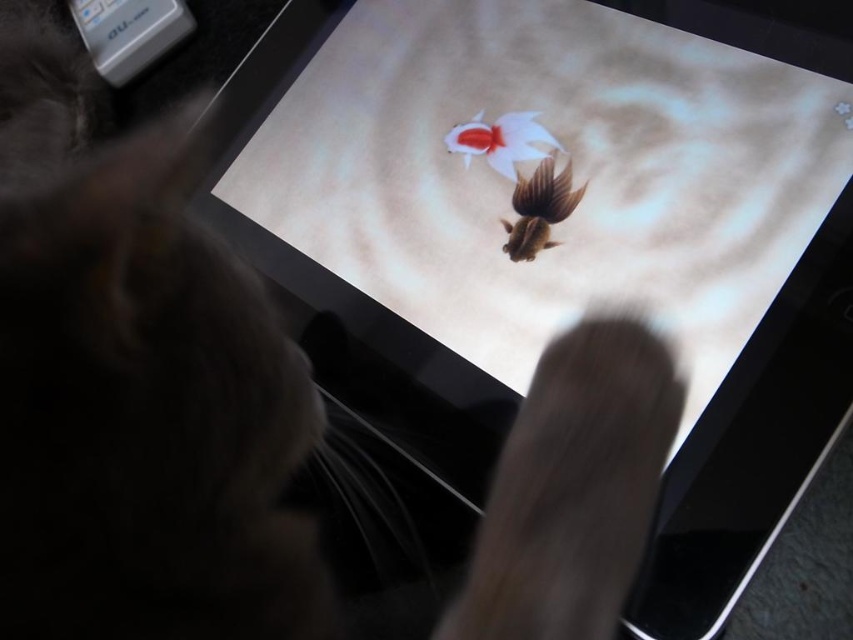
Question: Does shiny brown fish at center lie behind white glossy goldfish at center?

Choices:
 (A) yes
 (B) no

Answer: (B)

Question: Which point is closer to the camera taking this photo?

Choices:
 (A) (448, 144)
 (B) (547, 164)

Answer: (B)

Question: Which point is farther to the camera?

Choices:
 (A) white glossy goldfish at center
 (B) shiny brown fish at center

Answer: (A)

Question: Is shiny brown fish at center to the left of white glossy goldfish at center from the viewer's perspective?

Choices:
 (A) yes
 (B) no

Answer: (B)

Question: Can you confirm if shiny brown fish at center is bigger than white glossy goldfish at center?

Choices:
 (A) yes
 (B) no

Answer: (B)